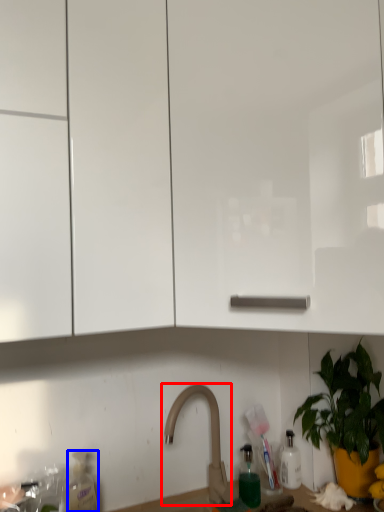
Question: Which object is further to the camera taking this photo, tap (highlighted by a red box) or bottle (highlighted by a blue box)?

Choices:
 (A) tap
 (B) bottle

Answer: (B)